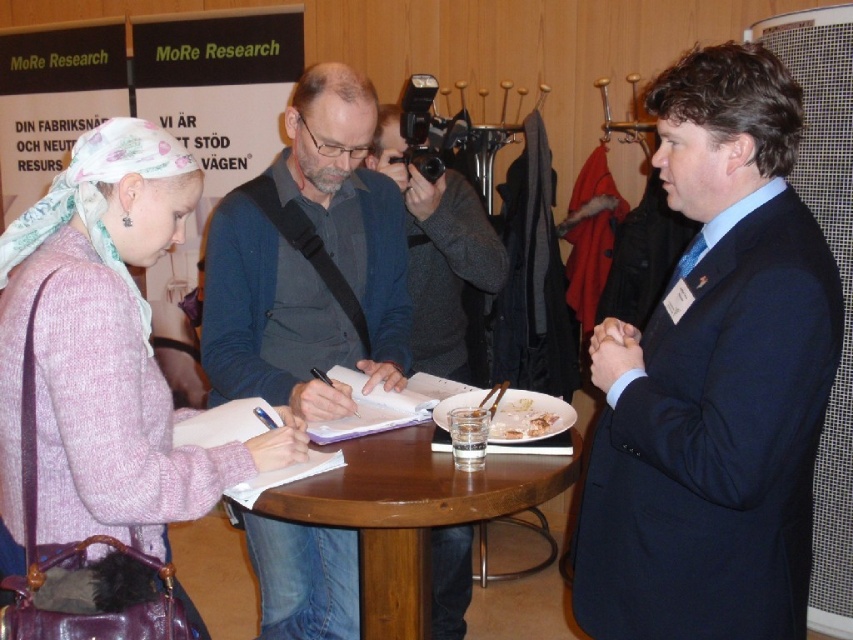
Question: Does pink knitted sweater at center lie behind dark blue sweater at center?

Choices:
 (A) yes
 (B) no

Answer: (B)

Question: Which point is farther from the camera taking this photo?

Choices:
 (A) (498, 417)
 (B) (424, 596)
 (C) (352, 264)
 (D) (140, 250)

Answer: (C)

Question: Which point is closer to the camera?

Choices:
 (A) (183, 504)
 (B) (519, 401)
 (C) (439, 230)
 (D) (691, 396)

Answer: (A)

Question: Where is pink knitted sweater at center located in relation to white paper plate at table center in the image?

Choices:
 (A) above
 (B) below

Answer: (A)

Question: Which point is farther to the camera?

Choices:
 (A) white paper plate at table center
 (B) dark blue suit at center

Answer: (A)

Question: Does dark blue sweater at center appear under white paper plate at table center?

Choices:
 (A) yes
 (B) no

Answer: (B)